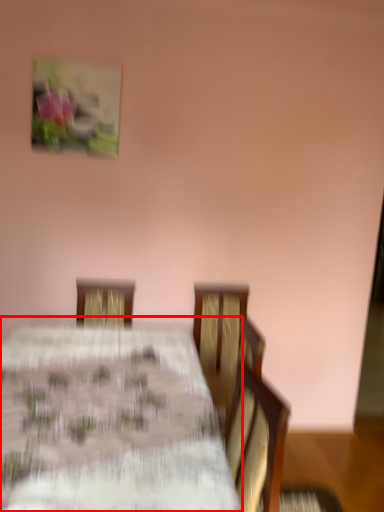
Question: In this image, where is table (annotated by the red box) located relative to picture frame?

Choices:
 (A) left
 (B) right

Answer: (B)